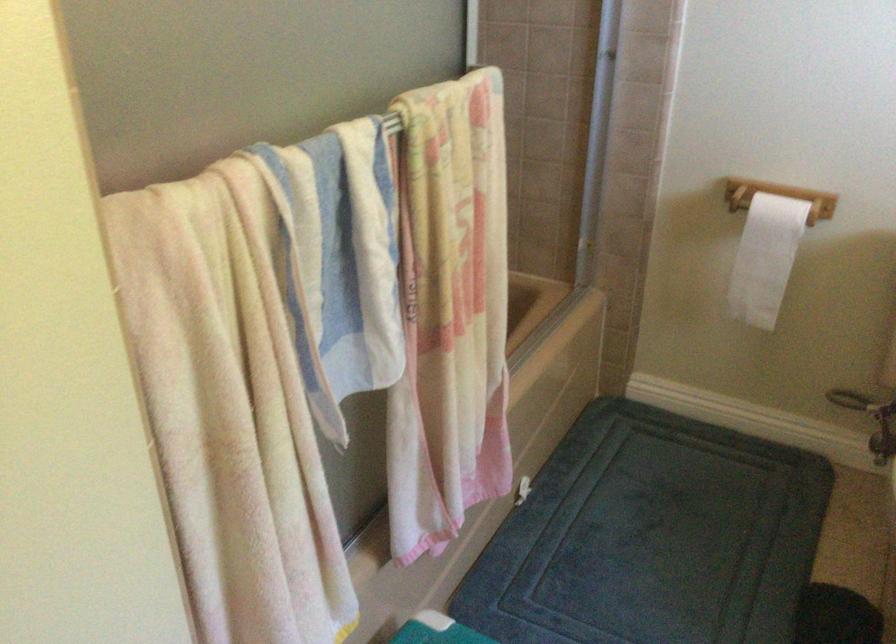
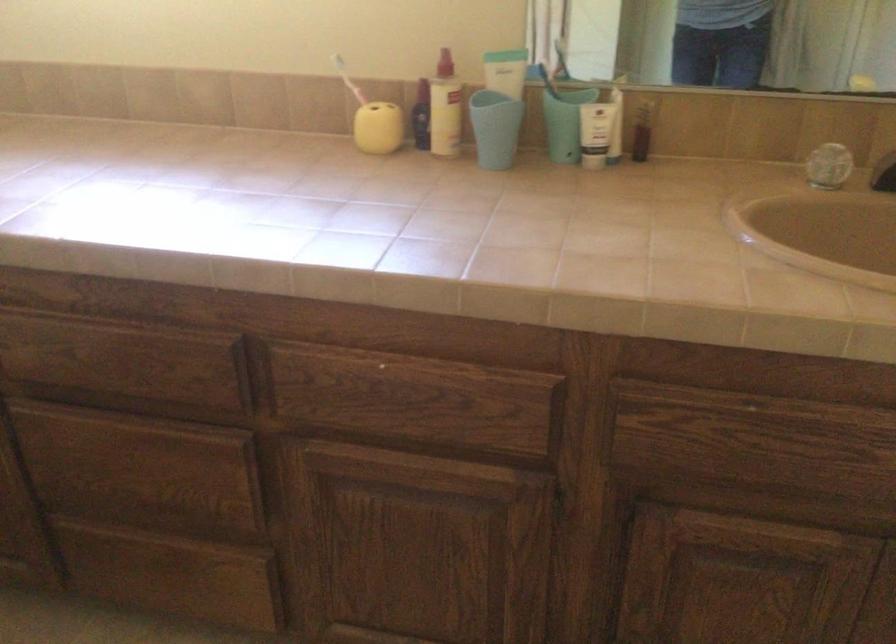
The images are taken continuously from a first-person perspective. In which direction is your viewpoint rotating?

The camera rotated toward right-down.